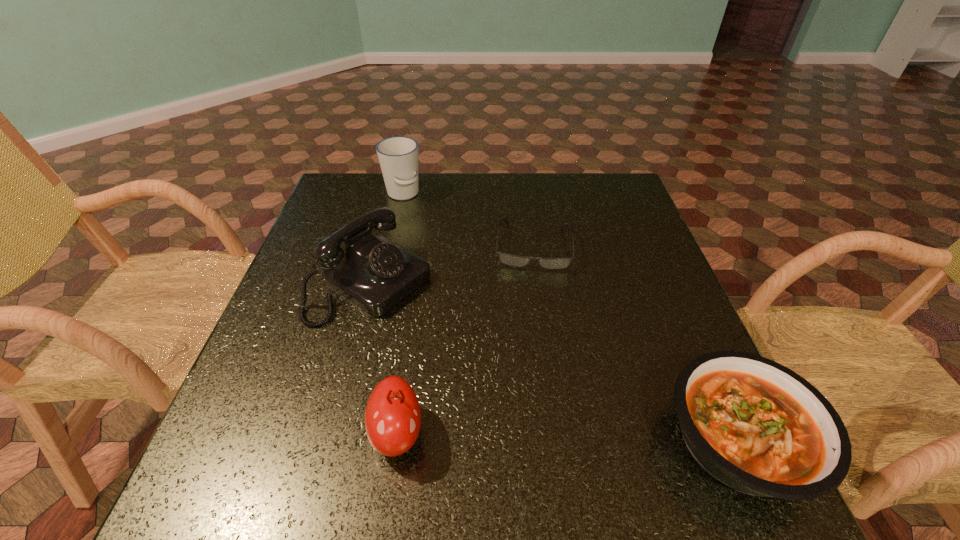
I want to click on free space located 0.300m with a handle on the side of the cup, so click(439, 271).

Locate an element on the screen. free spot located 0.110m with a handle on the side of the cup is located at coordinates (418, 227).

Find the location of a particular element. This screenshot has height=540, width=960. free point located 0.310m on the front-facing side of the second object from right to left is located at coordinates (528, 382).

Where is `free space located 0.050m on the front-facing side of the second object from right to left`? The width and height of the screenshot is (960, 540). free space located 0.050m on the front-facing side of the second object from right to left is located at coordinates click(x=532, y=287).

Where is `vacant space located 0.290m on the front-facing side of the second object from right to left`? The height and width of the screenshot is (540, 960). vacant space located 0.290m on the front-facing side of the second object from right to left is located at coordinates (528, 373).

You are a GUI agent. You are given a task and a screenshot of the screen. Output one action in this format:
    pyautogui.click(x=<x>, y=<y>)
    Task: Click on the free location located on the dial of the telephone
    This screenshot has height=540, width=960.
    Given the screenshot: What is the action you would take?
    pyautogui.click(x=557, y=404)

Locate an element on the screen. This screenshot has width=960, height=540. vacant area situated 0.210m on the dial of the telephone is located at coordinates (488, 359).

You are a GUI agent. You are given a task and a screenshot of the screen. Output one action in this format:
    pyautogui.click(x=<x>, y=<y>)
    Task: Click on the vacant space situated 0.050m on the dial of the telephone
    The height and width of the screenshot is (540, 960).
    Given the screenshot: What is the action you would take?
    pyautogui.click(x=429, y=321)

Locate an element on the screen. The image size is (960, 540). object present at the far edge is located at coordinates (398, 156).

At what (x,y) coordinates should I click in order to perform the action: click on apple located at the near edge. Please return your answer as a coordinate pair (x, y). Image resolution: width=960 pixels, height=540 pixels. Looking at the image, I should click on (393, 417).